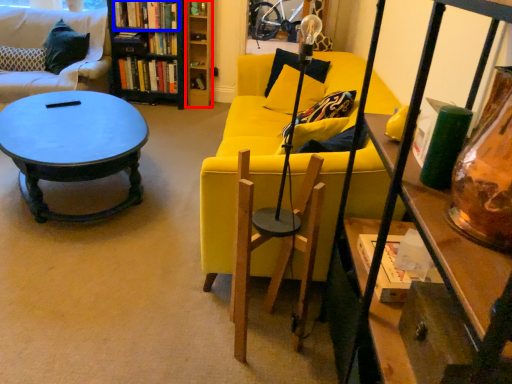
Question: Which point is closer to the camera, shelf (highlighted by a red box) or book (highlighted by a blue box)?

Choices:
 (A) shelf
 (B) book

Answer: (B)